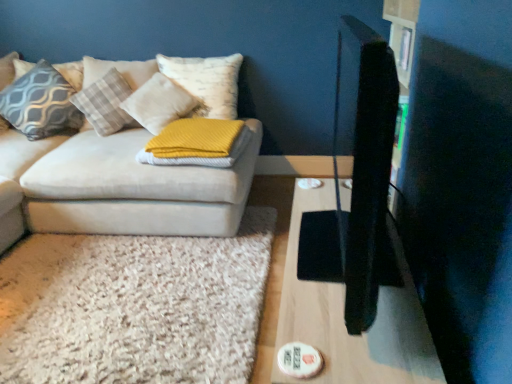
Question: Is the surface of velvet beige couch at left in direct contact with wooden table at right?

Choices:
 (A) no
 (B) yes

Answer: (A)

Question: Are velvet beige couch at left and wooden table at right far apart?

Choices:
 (A) yes
 (B) no

Answer: (A)

Question: Can you confirm if velvet beige couch at left is taller than wooden table at right?

Choices:
 (A) no
 (B) yes

Answer: (B)

Question: Can you confirm if velvet beige couch at left is wider than wooden table at right?

Choices:
 (A) yes
 (B) no

Answer: (A)

Question: Considering the relative sizes of velvet beige couch at left and wooden table at right in the image provided, is velvet beige couch at left shorter than wooden table at right?

Choices:
 (A) yes
 (B) no

Answer: (B)

Question: Considering the positions of yellow knitted blanket at center, which is counted as the 1th pillow, starting from the right, and velvet beige couch at left in the image, is yellow knitted blanket at center, which is counted as the 1th pillow, starting from the right, taller or shorter than velvet beige couch at left?

Choices:
 (A) short
 (B) tall

Answer: (A)

Question: Is point (168, 152) closer or farther from the camera than point (142, 140)?

Choices:
 (A) farther
 (B) closer

Answer: (B)

Question: Is yellow knitted blanket at center, which ranks as the 5th pillow in left-to-right order, bigger or smaller than velvet beige couch at left?

Choices:
 (A) small
 (B) big

Answer: (A)

Question: Is yellow knitted blanket at center, which ranks as the 5th pillow in left-to-right order, to the left or to the right of velvet beige couch at left in the image?

Choices:
 (A) right
 (B) left

Answer: (A)

Question: Looking at their shapes, would you say yellow knitted blanket at center, which is counted as the 1th pillow, starting from the right, is wider or thinner than matte gray pillow at left, placed as the 2th pillow when sorted from left to right?

Choices:
 (A) thin
 (B) wide

Answer: (B)

Question: Is yellow knitted blanket at center, which is counted as the 1th pillow, starting from the right, situated inside matte gray pillow at left, placed as the 2th pillow when sorted from left to right, or outside?

Choices:
 (A) inside
 (B) outside

Answer: (B)

Question: Based on their sizes in the image, would you say yellow knitted blanket at center, which is counted as the 1th pillow, starting from the right, is bigger or smaller than matte gray pillow at left, which is counted as the fourth pillow, starting from the right?

Choices:
 (A) big
 (B) small

Answer: (B)

Question: From a real-world perspective, is yellow knitted blanket at center, which ranks as the 5th pillow in left-to-right order, physically located above or below matte gray pillow at left, placed as the 2th pillow when sorted from left to right?

Choices:
 (A) below
 (B) above

Answer: (A)

Question: From their relative heights in the image, would you say yellow knitted blanket at center, which ranks as the 5th pillow in left-to-right order, is taller or shorter than patterned fabric pillow at upper left, which appears as the 1th pillow when viewed from the left?

Choices:
 (A) short
 (B) tall

Answer: (A)

Question: Based on their sizes in the image, would you say yellow knitted blanket at center, which ranks as the 5th pillow in left-to-right order, is bigger or smaller than patterned fabric pillow at upper left, placed as the 5th pillow when sorted from right to left?

Choices:
 (A) small
 (B) big

Answer: (A)